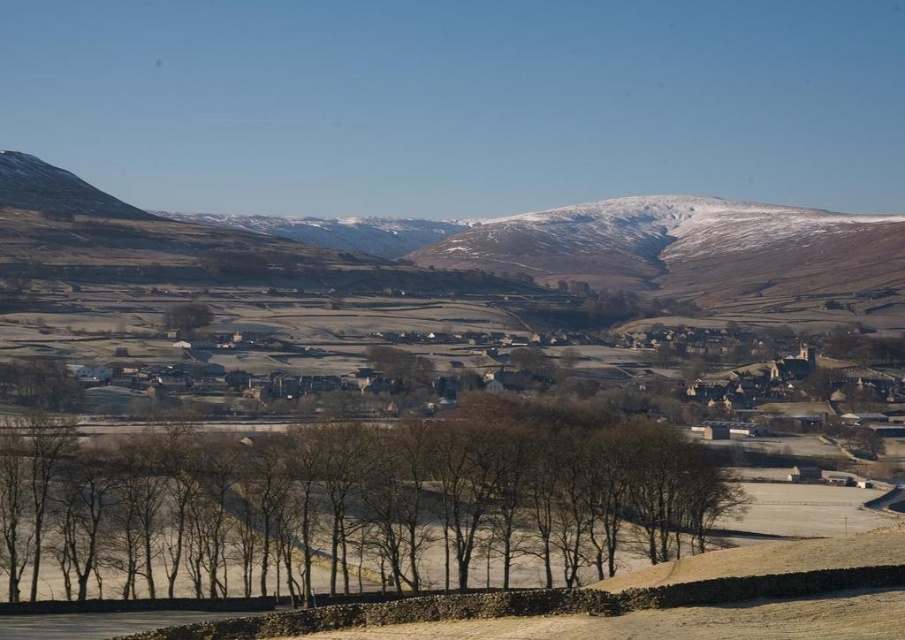
Does snow-covered mountain at left have a lesser width compared to brown textured tree at center?

No, snow-covered mountain at left is not thinner than brown textured tree at center.

The image size is (905, 640). What do you see at coordinates (568, 240) in the screenshot? I see `snow-covered mountain at left` at bounding box center [568, 240].

Find the location of a particular element. snow-covered mountain at left is located at coordinates (568, 240).

Measure the distance between point (194, 529) and camera.

The distance of point (194, 529) from camera is 101.25 meters.

Between point (35, 492) and point (175, 326), which one is positioned behind?

Point (175, 326)

Who is more distant from viewer, (387, 573) or (189, 301)?

Positioned behind is point (189, 301).

What are the coordinates of `bare branches at center` in the screenshot? It's located at (367, 500).

In the scene shown: Who is higher up, snow-covered mountain at left or snow-covered mountain at center?

snow-covered mountain at left is higher up.

Looking at this image, does snow-covered mountain at left appear over snow-covered mountain at center?

Yes, snow-covered mountain at left is above snow-covered mountain at center.

Is point (575, 234) less distant than point (724, 202)?

Yes, point (575, 234) is in front of point (724, 202).

Identify the location of snow-covered mountain at left. (568, 240).